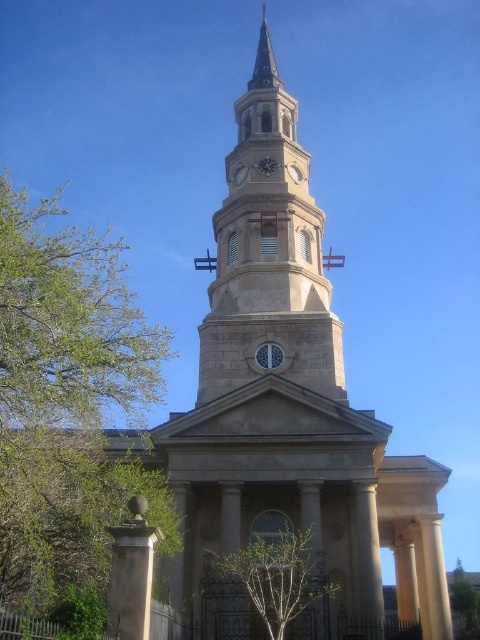
In the scene shown: Does green leafy tree at lower right lie behind black metal clock at upper center?

Yes, green leafy tree at lower right is further from the viewer.

Is green leafy tree at lower right to the right of black metal clock at upper center from the viewer's perspective?

Indeed, green leafy tree at lower right is positioned on the right side of black metal clock at upper center.

This screenshot has height=640, width=480. Identify the location of green leafy tree at lower right. (465, 604).

Find the location of `green leafy tree at lower right`. green leafy tree at lower right is located at coordinates 465,604.

Is green leafy tree at left wider than green leafy tree at lower right?

Yes, green leafy tree at left is wider than green leafy tree at lower right.

Between green leafy tree at left and green leafy tree at lower right, which one appears on the left side from the viewer's perspective?

Positioned to the left is green leafy tree at left.

Is point (19, 472) more distant than point (468, 572)?

No, (19, 472) is in front of (468, 572).

The height and width of the screenshot is (640, 480). What are the coordinates of `green leafy tree at left` in the screenshot? It's located at (67, 401).

Is green leafy tree at center behind green leafy tree at lower right?

No.

Which is above, green leafy tree at center or green leafy tree at lower right?

green leafy tree at center

Measure the distance between green leafy tree at center and camera.

green leafy tree at center and camera are 41.08 meters apart.

Locate an element on the screen. green leafy tree at center is located at coordinates click(x=264, y=588).